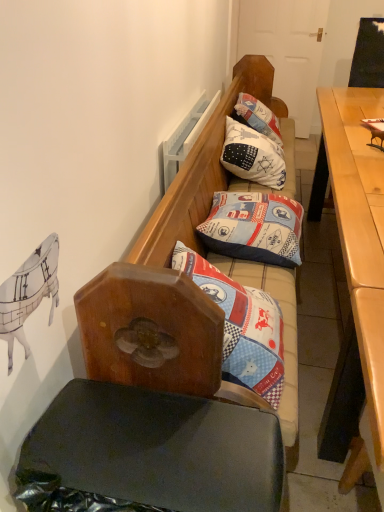
Question: From a real-world perspective, is patchwork fabric pillow at upper center, the 1th pillow when ordered from back to front, physically located above or below patchwork fabric pillow at center, which appears as the second pillow when viewed from the back?

Choices:
 (A) above
 (B) below

Answer: (A)

Question: Is patchwork fabric pillow at upper center, acting as the first pillow starting from the top, spatially inside patchwork fabric pillow at center, placed as the second pillow when sorted from top to bottom, or outside of it?

Choices:
 (A) outside
 (B) inside

Answer: (A)

Question: Which object is positioned farthest from the light brown wooden desk at right?

Choices:
 (A) wooden bench with patterned cushions at center
 (B) patchwork fabric pillow at center, placed as the second pillow when sorted from top to bottom
 (C) patchwork fabric pillow at upper center, the 2th pillow in the bottom-to-top sequence

Answer: (A)

Question: Estimate the real-world distances between objects in this image. Which object is closer to the patchwork fabric pillow at upper center, the 2th pillow in the bottom-to-top sequence?

Choices:
 (A) patchwork fabric pillow at center, which appears as the second pillow when viewed from the back
 (B) light brown wooden desk at right
 (C) wooden bench with patterned cushions at center

Answer: (A)